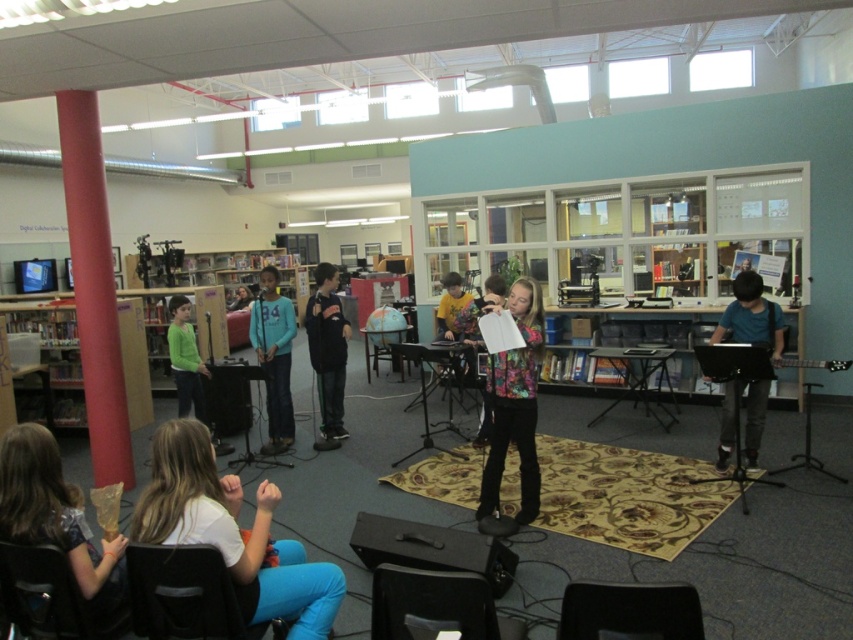
Describe the element at coordinates (184, 595) in the screenshot. I see `black fabric chair at lower left` at that location.

Between black fabric chair at lower left and blue fabric guitar at right, which one is positioned higher?

blue fabric guitar at right is above.

You are a GUI agent. You are given a task and a screenshot of the screen. Output one action in this format:
    pyautogui.click(x=<x>, y=<y>)
    Task: Click on the black fabric chair at lower left
    
    Given the screenshot: What is the action you would take?
    pyautogui.click(x=184, y=595)

Is blue fabric guitar at right further to camera compared to floral fabric shirt at center?

No, blue fabric guitar at right is in front of floral fabric shirt at center.

Can you confirm if blue fabric guitar at right is taller than floral fabric shirt at center?

Indeed, blue fabric guitar at right has a greater height compared to floral fabric shirt at center.

Does point (740, 288) come closer to viewer compared to point (468, 362)?

Yes, point (740, 288) is in front of point (468, 362).

Find the location of a particular element. Image resolution: width=853 pixels, height=640 pixels. blue fabric guitar at right is located at coordinates (750, 316).

Does matte blue shirt at center have a larger size compared to floral fabric shirt at center?

Indeed, matte blue shirt at center has a larger size compared to floral fabric shirt at center.

What are the coordinates of `matte blue shirt at center` in the screenshot? It's located at (274, 356).

Find the location of a particular element. This screenshot has width=853, height=640. matte blue shirt at center is located at coordinates (274, 356).